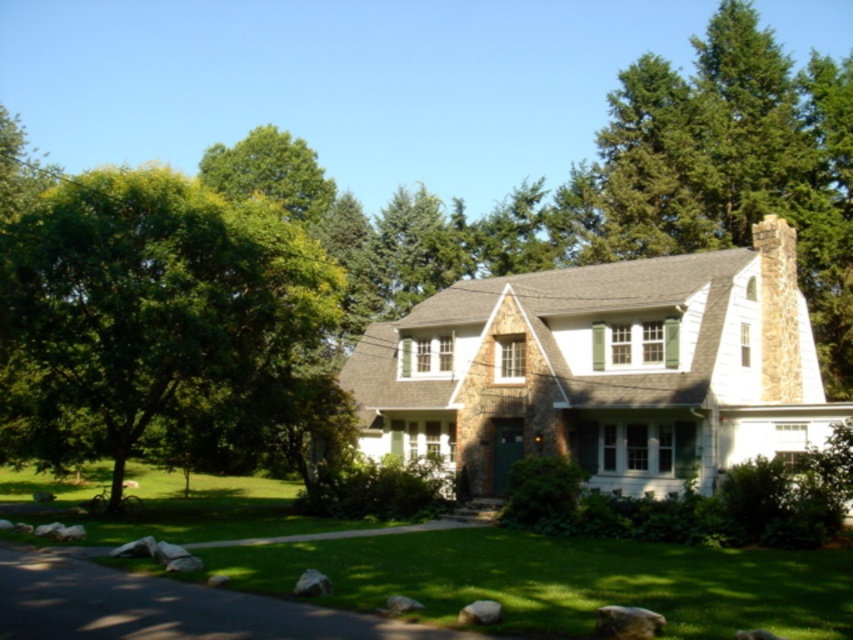
From the picture: Can you confirm if green leafy tree at left is thinner than green grass at center?

Correct, green leafy tree at left's width is less than green grass at center's.

Is green leafy tree at left shorter than green grass at center?

In fact, green leafy tree at left may be taller than green grass at center.

Describe the element at coordinates (144, 307) in the screenshot. Image resolution: width=853 pixels, height=640 pixels. I see `green leafy tree at left` at that location.

Image resolution: width=853 pixels, height=640 pixels. I want to click on green leafy tree at left, so click(144, 307).